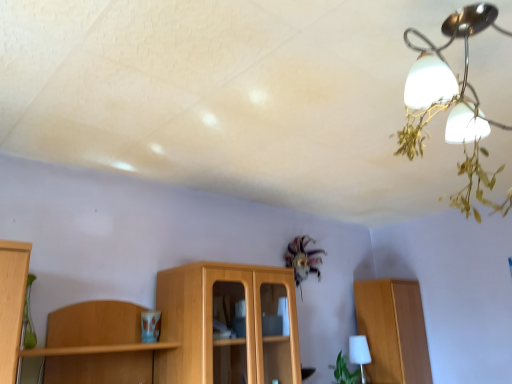
Question: Are satin silver chandelier at upper right and white matte table lamp at lower right making contact?

Choices:
 (A) yes
 (B) no

Answer: (B)

Question: Is satin silver chandelier at upper right far from white matte table lamp at lower right?

Choices:
 (A) yes
 (B) no

Answer: (A)

Question: Is satin silver chandelier at upper right positioned beyond the bounds of white matte table lamp at lower right?

Choices:
 (A) yes
 (B) no

Answer: (A)

Question: Is satin silver chandelier at upper right bigger than white matte table lamp at lower right?

Choices:
 (A) yes
 (B) no

Answer: (A)

Question: Is satin silver chandelier at upper right to the left of white matte table lamp at lower right from the viewer's perspective?

Choices:
 (A) yes
 (B) no

Answer: (A)

Question: Can you confirm if satin silver chandelier at upper right is smaller than white matte table lamp at lower right?

Choices:
 (A) no
 (B) yes

Answer: (A)

Question: Can you confirm if green leafy plant at lower right is wider than satin silver chandelier at upper right?

Choices:
 (A) yes
 (B) no

Answer: (B)

Question: Is green leafy plant at lower right not within satin silver chandelier at upper right?

Choices:
 (A) no
 (B) yes

Answer: (B)

Question: From a real-world perspective, is green leafy plant at lower right under satin silver chandelier at upper right?

Choices:
 (A) yes
 (B) no

Answer: (A)

Question: From the image's perspective, is green leafy plant at lower right below satin silver chandelier at upper right?

Choices:
 (A) yes
 (B) no

Answer: (A)

Question: Is the depth of green leafy plant at lower right greater than that of satin silver chandelier at upper right?

Choices:
 (A) no
 (B) yes

Answer: (B)

Question: Is green leafy plant at lower right touching satin silver chandelier at upper right?

Choices:
 (A) no
 (B) yes

Answer: (A)

Question: Is white matte table lamp at lower right in contact with satin silver chandelier at upper right?

Choices:
 (A) yes
 (B) no

Answer: (B)